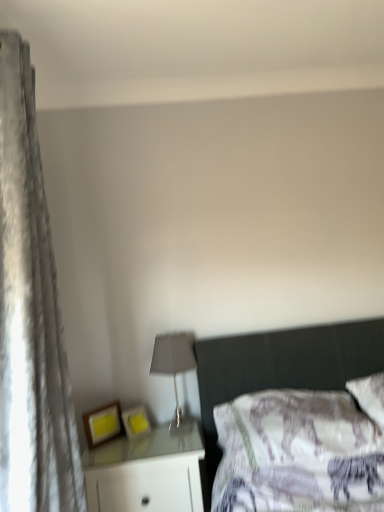
The width and height of the screenshot is (384, 512). In order to click on vacant space in between matte wooden picture frame at lower left, which is the first picture frame in left-to-right order, and matte gray lampshade at center in this screenshot , I will do `click(130, 441)`.